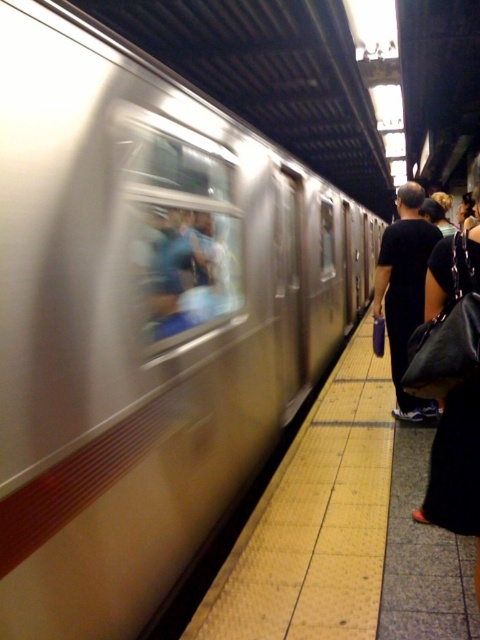
You are a passenger waiting on the platform. You see the yellow tile platform at center and the black fabric bag at right. Which object is closer to you as you face the train?

The yellow tile platform at center is closer to you because it is in front of the black fabric bag at right.

In the scene shown: You are standing on the subway platform and want to locate the yellow tactile paving strip. According to the image, where is the point at coordinate (344, 531) located?

The point at coordinate (344, 531) is located on the yellow tile platform at center, which is where the yellow tactile paving strip is placed.